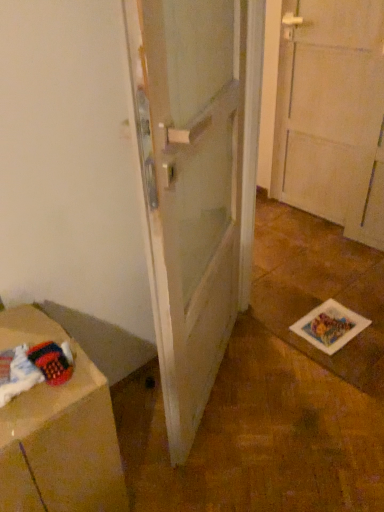
This screenshot has height=512, width=384. I want to click on white matte door at center, so click(x=191, y=191).

Describe the element at coordinates (191, 191) in the screenshot. I see `white matte door at center` at that location.

What is the approximate width of brown cardboard at lower left?

brown cardboard at lower left is 15.09 inches in width.

Where is `brown cardboard at lower left`? brown cardboard at lower left is located at coordinates (58, 432).

Describe the element at coordinates (58, 432) in the screenshot. I see `brown cardboard at lower left` at that location.

Measure the distance between brown cardboard at lower left and camera.

brown cardboard at lower left is 31.29 inches away from camera.

This screenshot has height=512, width=384. I want to click on white matte door at center, so click(191, 191).

Does brown cardboard at lower left appear on the left side of white matte door at center?

Correct, you'll find brown cardboard at lower left to the left of white matte door at center.

Which object is further away from the camera taking this photo, brown cardboard at lower left or white matte door at center?

brown cardboard at lower left is more distant.

Which is nearer, [73,504] or [185,256]?

Point [73,504] is positioned closer to the camera compared to point [185,256].

From the image's perspective, is brown cardboard at lower left beneath white matte door at center?

Yes.

From a real-world perspective, between brown cardboard at lower left and white matte door at center, who is vertically lower?

From a 3D spatial view, brown cardboard at lower left is below.

Considering the sizes of objects brown cardboard at lower left and white matte door at center in the image provided, who is thinner, brown cardboard at lower left or white matte door at center?

white matte door at center.

Who is taller, brown cardboard at lower left or white matte door at center?

With more height is white matte door at center.

Which of these two, brown cardboard at lower left or white matte door at center, is bigger?

Bigger between the two is white matte door at center.

Does brown cardboard at lower left contain white matte door at center?

That's incorrect, white matte door at center is not inside brown cardboard at lower left.

Is brown cardboard at lower left far away from white matte door at center?

No, there isn't a large distance between brown cardboard at lower left and white matte door at center.

Is white matte door at center at the back of brown cardboard at lower left?

brown cardboard at lower left does not have its back to white matte door at center.

Can you tell me how much brown cardboard at lower left and white matte door at center differ in facing direction?

brown cardboard at lower left and white matte door at center are facing 32.2 degrees away from each other.

Find the location of a particular element. The height and width of the screenshot is (512, 384). cabinetry below the white matte door at center (from a real-world perspective) is located at coordinates (58, 432).

Which is more to the left, white matte door at center or brown cardboard at lower left?

Positioned to the left is brown cardboard at lower left.

Which object is closer to the camera taking this photo, white matte door at center or brown cardboard at lower left?

white matte door at center is more forward.

Is point (213, 245) farther from camera compared to point (23, 458)?

Yes, it is behind point (23, 458).

From the image's perspective, is white matte door at center located beneath brown cardboard at lower left?

No, from the image's perspective, white matte door at center is not below brown cardboard at lower left.

From a real-world perspective, is white matte door at center positioned over brown cardboard at lower left based on gravity?

Yes.

Is white matte door at center wider or thinner than brown cardboard at lower left?

In the image, white matte door at center appears to be more narrow than brown cardboard at lower left.

Between white matte door at center and brown cardboard at lower left, which one has less height?

With less height is brown cardboard at lower left.

Is white matte door at center bigger or smaller than brown cardboard at lower left?

Considering their sizes, white matte door at center takes up more space than brown cardboard at lower left.

Does white matte door at center contain brown cardboard at lower left?

No, white matte door at center does not contain brown cardboard at lower left.

Are white matte door at center and brown cardboard at lower left beside each other?

No, white matte door at center is not next to brown cardboard at lower left.

Is white matte door at center positioned with its back to brown cardboard at lower left?

No, white matte door at center's orientation is not away from brown cardboard at lower left.

What's the angular difference between white matte door at center and brown cardboard at lower left's facing directions?

They differ by 32.2 degrees in their facing directions.

Locate an element on the screen. This screenshot has height=512, width=384. door on the right of the brown cardboard at lower left is located at coordinates (191, 191).

Where is `cabinetry lying below the white matte door at center (from the image's perspective)`? This screenshot has height=512, width=384. cabinetry lying below the white matte door at center (from the image's perspective) is located at coordinates (58, 432).

What are the coordinates of `door to the right of brown cardboard at lower left` in the screenshot? It's located at tap(191, 191).